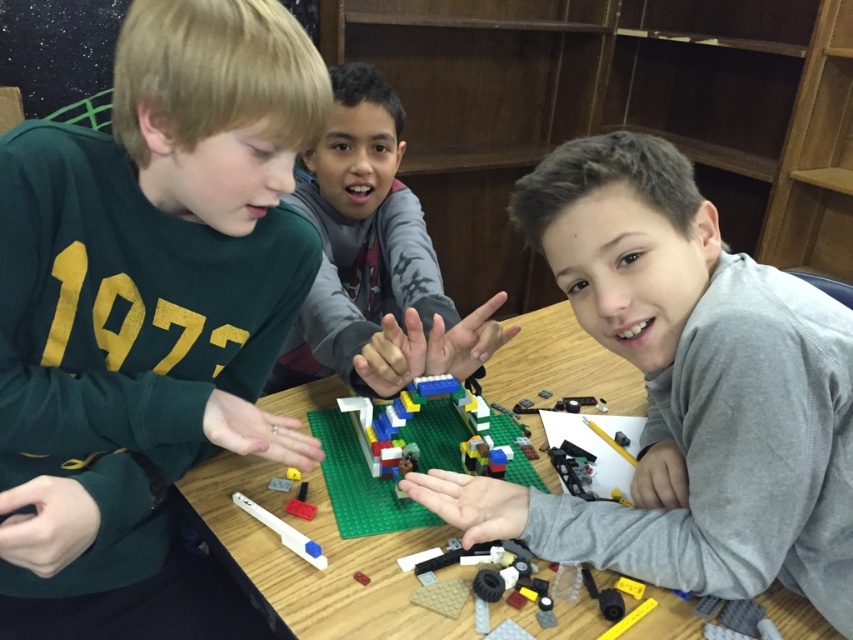
You are a photographer standing in front of the green plastic table at center. You want to take a photo of the table so that it fills the frame without any distortion. The camera you are using has a focal length of 50mm. What is the minimum distance you need to be from the table to achieve this?

The green plastic table at center is 31.46 inches from the camera. To fill the frame with the table without distortion at a 50mm focal length, you should position yourself approximately 31.46 inches away from the table.

You are standing in front of the wooden table where the children are building a LEGO structure. You notice a point marked at coordinates [148,316]. Which child is located at that point?

The point at [148,316] marks the green matte shirt at left, so the child wearing the green matte shirt at left is located there.